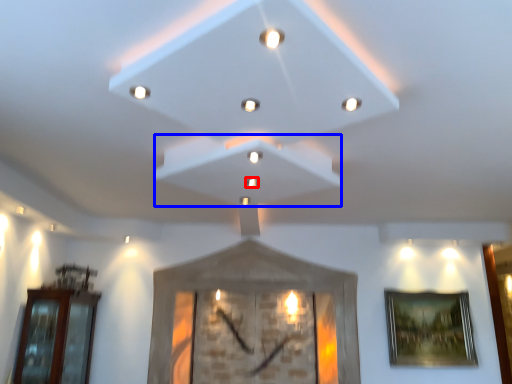
Question: Among these objects, which one is farthest to the camera, light (highlighted by a red box) or exhaust hood (highlighted by a blue box)?

Choices:
 (A) light
 (B) exhaust hood

Answer: (A)